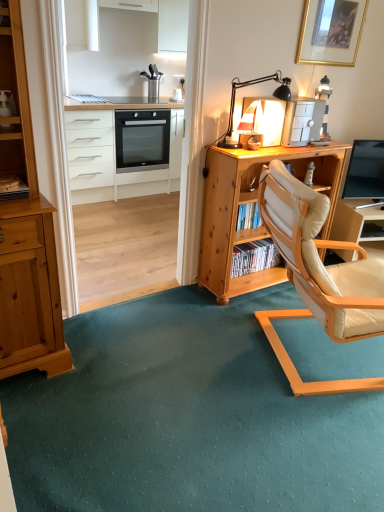
Question: Does matte white lamp at upper center, placed as the 2th appliance when sorted from right to left, turn towards beige leather chair at center-right?

Choices:
 (A) yes
 (B) no

Answer: (B)

Question: From the image's perspective, is matte white lamp at upper center, placed as the 2th appliance when sorted from right to left, on top of beige leather chair at center-right?

Choices:
 (A) yes
 (B) no

Answer: (A)

Question: Does matte white lamp at upper center, placed as the 2th appliance when sorted from right to left, lie in front of beige leather chair at center-right?

Choices:
 (A) no
 (B) yes

Answer: (A)

Question: Are matte white lamp at upper center, which is the 1th appliance in left-to-right order, and beige leather chair at center-right beside each other?

Choices:
 (A) yes
 (B) no

Answer: (B)

Question: From the image's perspective, would you say matte white lamp at upper center, placed as the 2th appliance when sorted from right to left, is shown under beige leather chair at center-right?

Choices:
 (A) yes
 (B) no

Answer: (B)

Question: Relative to beige leather chair at center-right, is matte white lamp at upper center, placed as the 2th appliance when sorted from right to left, in front or behind?

Choices:
 (A) behind
 (B) front

Answer: (A)

Question: Considering the positions of matte white lamp at upper center, which is the 1th appliance in left-to-right order, and beige leather chair at center-right in the image, is matte white lamp at upper center, which is the 1th appliance in left-to-right order, wider or thinner than beige leather chair at center-right?

Choices:
 (A) thin
 (B) wide

Answer: (A)

Question: Is point (243, 100) closer or farther from the camera than point (263, 200)?

Choices:
 (A) farther
 (B) closer

Answer: (A)

Question: In the image, is matte white lamp at upper center, which is the 1th appliance in left-to-right order, on the left side or the right side of beige leather chair at center-right?

Choices:
 (A) right
 (B) left

Answer: (B)

Question: Considering the positions of point (231, 122) and point (180, 160), is point (231, 122) closer or farther from the camera than point (180, 160)?

Choices:
 (A) closer
 (B) farther

Answer: (A)

Question: In the image, is black metal table lamp at upper right on the left side or the right side of white glossy chest of drawers at upper left?

Choices:
 (A) right
 (B) left

Answer: (A)

Question: From a real-world perspective, is black metal table lamp at upper right positioned above or below white glossy chest of drawers at upper left?

Choices:
 (A) below
 (B) above

Answer: (B)

Question: In terms of size, does black metal table lamp at upper right appear bigger or smaller than white glossy chest of drawers at upper left?

Choices:
 (A) big
 (B) small

Answer: (B)

Question: Considering the relative positions of matte black tv at right and white plastic printer at upper right, the first appliance viewed from the right, in the image provided, is matte black tv at right to the left or to the right of white plastic printer at upper right, the first appliance viewed from the right,?

Choices:
 (A) left
 (B) right

Answer: (B)

Question: In terms of height, does matte black tv at right look taller or shorter compared to white plastic printer at upper right, the first appliance viewed from the right?

Choices:
 (A) tall
 (B) short

Answer: (A)